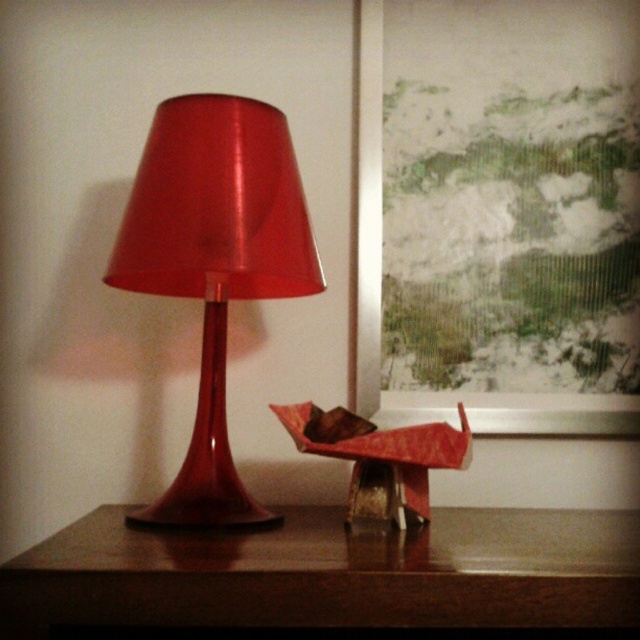
Is point (438, 545) in front of point (280, 184)?

Yes, it is.

Is point (257, 564) behind point (275, 150)?

No.

Where is `wooden table at center`? wooden table at center is located at coordinates (333, 573).